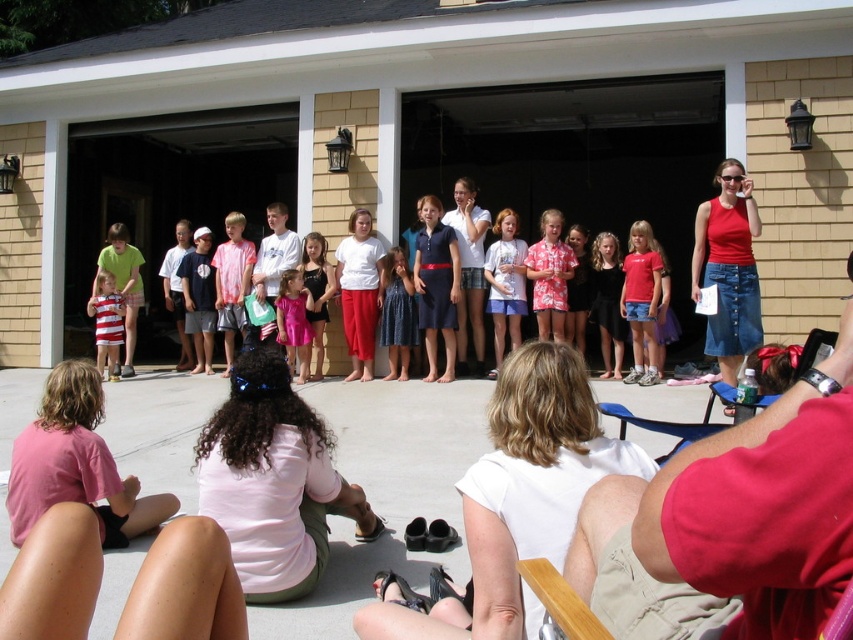
Question: Does white matte shirt at center appear over matte white shirt at center?

Choices:
 (A) yes
 (B) no

Answer: (B)

Question: Which object is positioned closest to the pink fabric shirt at lower center?

Choices:
 (A) denim skirt at right
 (B) striped cotton dress at left

Answer: (A)

Question: Does striped cotton shorts at left have a lesser width compared to striped cotton dress at left?

Choices:
 (A) yes
 (B) no

Answer: (B)

Question: Which point appears farthest from the camera in this image?

Choices:
 (A) (13, 513)
 (B) (480, 557)

Answer: (A)

Question: Which object appears farthest from the camera in this image?

Choices:
 (A) striped cotton dress at left
 (B) denim skirt at right
 (C) white matte shirt at center

Answer: (A)

Question: Does matte white shirt at center have a larger size compared to pink fabric dress at center?

Choices:
 (A) yes
 (B) no

Answer: (B)